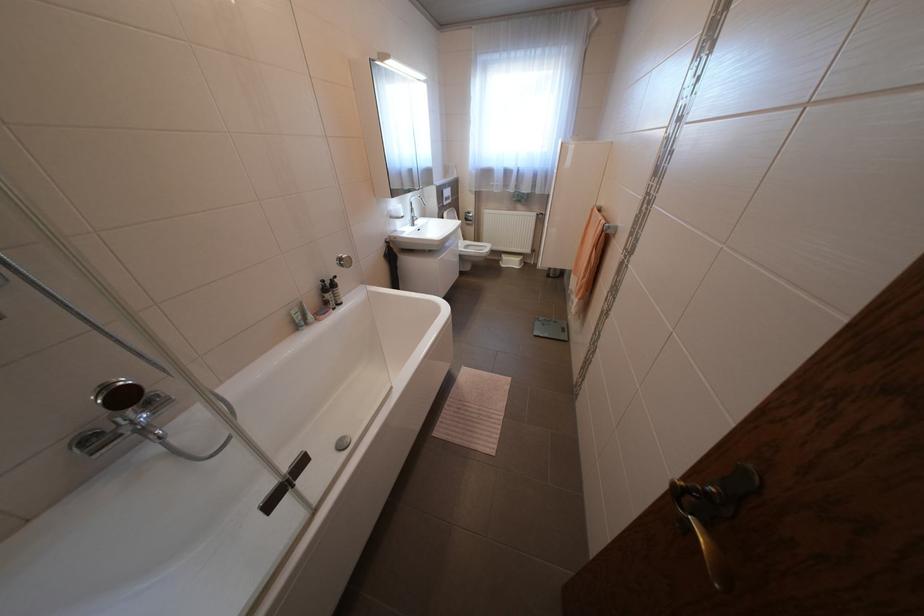
What do you see at coordinates (325, 294) in the screenshot?
I see `a black pump dispenser` at bounding box center [325, 294].